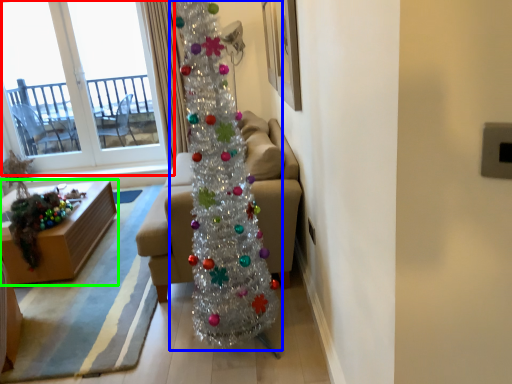
Question: Which is farther away from window (highlighted by a red box)? christmas tree (highlighted by a blue box) or table (highlighted by a green box)?

Choices:
 (A) christmas tree
 (B) table

Answer: (A)